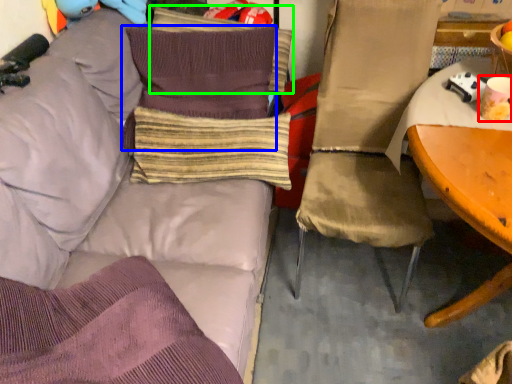
Question: Considering the real-world distances, which object is closest to coffee cup (highlighted by a red box)? pillow (highlighted by a blue box) or pillow (highlighted by a green box).

Choices:
 (A) pillow
 (B) pillow

Answer: (A)